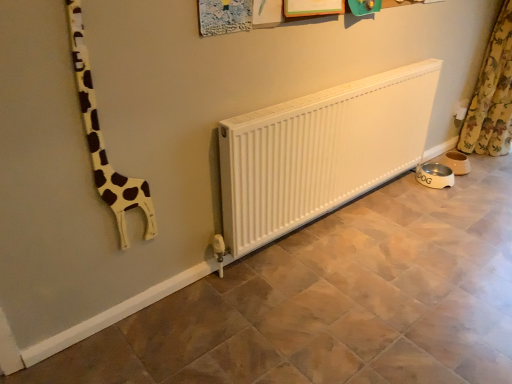
Question: Is white matte giraffe at left to the right of floral fabric curtain at right from the viewer's perspective?

Choices:
 (A) no
 (B) yes

Answer: (A)

Question: Would you consider white matte giraffe at left to be distant from floral fabric curtain at right?

Choices:
 (A) no
 (B) yes

Answer: (B)

Question: Could you tell me if white matte giraffe at left is turned towards floral fabric curtain at right?

Choices:
 (A) yes
 (B) no

Answer: (B)

Question: Is white matte giraffe at left at the left side of floral fabric curtain at right?

Choices:
 (A) no
 (B) yes

Answer: (B)

Question: Is white matte giraffe at left bigger than floral fabric curtain at right?

Choices:
 (A) no
 (B) yes

Answer: (A)

Question: Does white matte giraffe at left lie in front of floral fabric curtain at right?

Choices:
 (A) no
 (B) yes

Answer: (B)

Question: Is floral fabric curtain at right directly adjacent to white matte giraffe at left?

Choices:
 (A) yes
 (B) no

Answer: (B)

Question: Is floral fabric curtain at right positioned far away from white matte giraffe at left?

Choices:
 (A) no
 (B) yes

Answer: (B)

Question: Is floral fabric curtain at right outside of white matte giraffe at left?

Choices:
 (A) no
 (B) yes

Answer: (B)

Question: From the image's perspective, is floral fabric curtain at right located above white matte giraffe at left?

Choices:
 (A) yes
 (B) no

Answer: (A)

Question: Is floral fabric curtain at right smaller than white matte giraffe at left?

Choices:
 (A) no
 (B) yes

Answer: (A)

Question: Does floral fabric curtain at right appear on the right side of white matte giraffe at left?

Choices:
 (A) yes
 (B) no

Answer: (A)

Question: From the image's perspective, is floral fabric curtain at right located above or below white matte giraffe at left?

Choices:
 (A) above
 (B) below

Answer: (A)